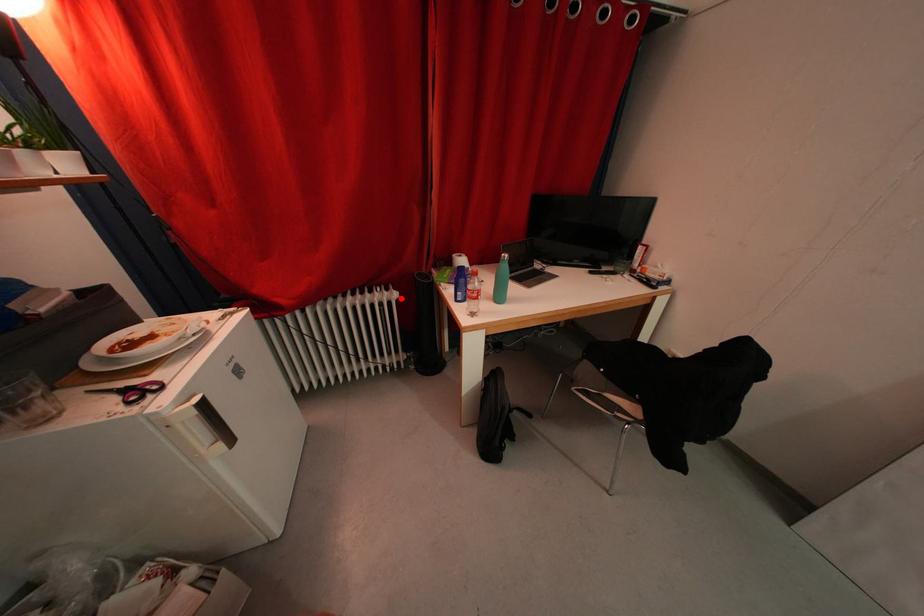
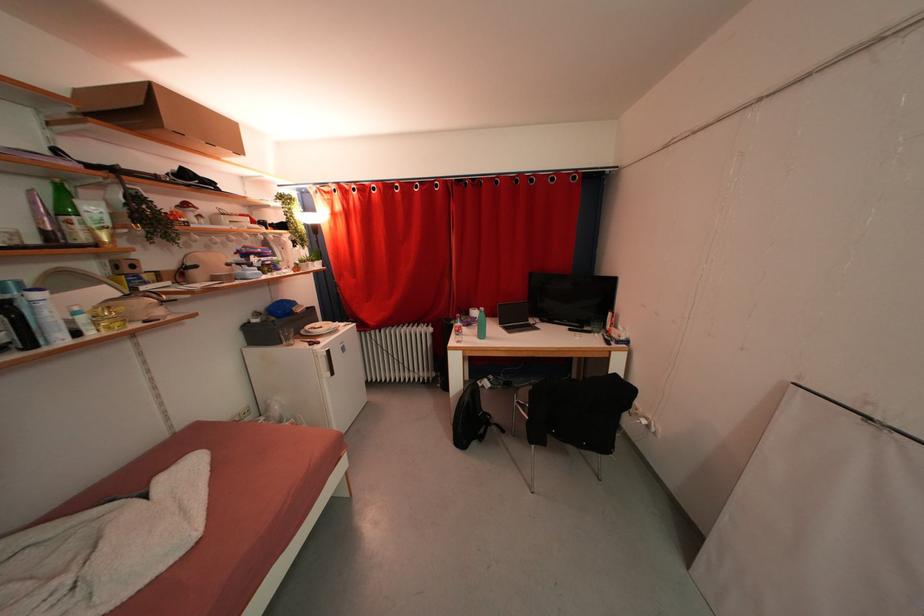
Where in the second image is the point corresponding to the highlighted location from the first image?

(436, 333)